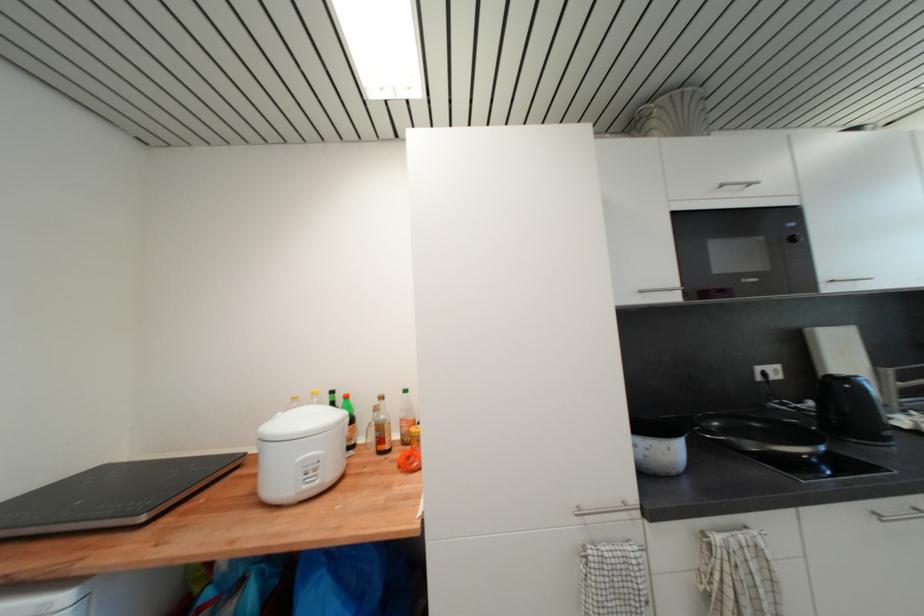
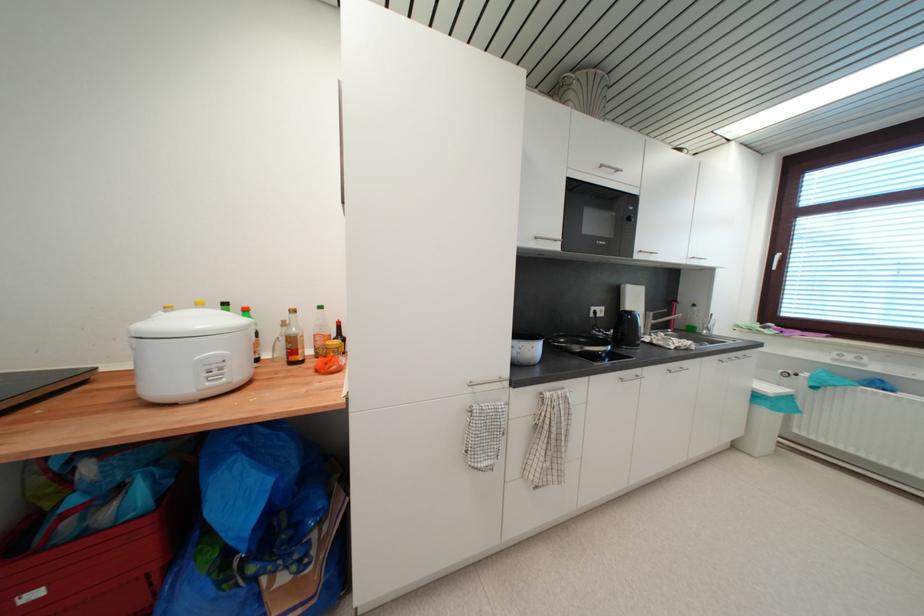
In the second image, find the point that corresponds to the point at 409,432 in the first image.

(324, 345)